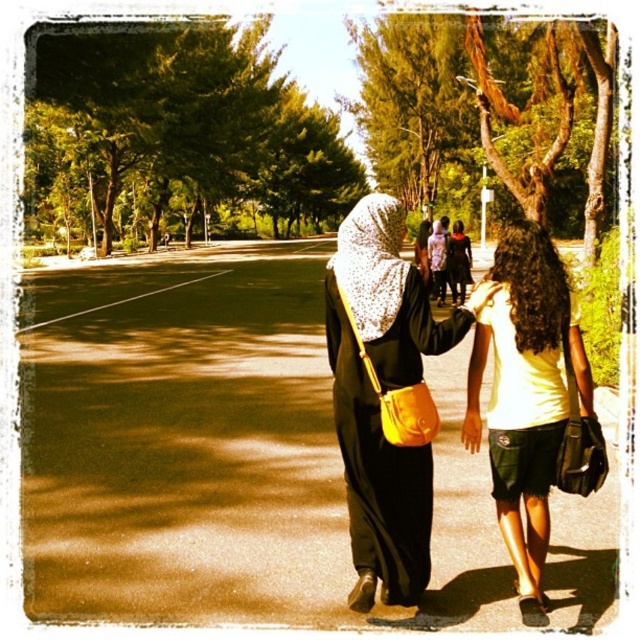
Does point (529, 460) come in front of point (532, 416)?

No, it is not.

This screenshot has width=640, height=640. I want to click on matte yellow shirt at center, so click(525, 396).

Is matte yellow bag at center taller than matte yellow shirt at center?

No, matte yellow bag at center is not taller than matte yellow shirt at center.

What do you see at coordinates (385, 397) in the screenshot? I see `matte yellow bag at center` at bounding box center [385, 397].

Does point (410, 397) come in front of point (509, 352)?

Yes, point (410, 397) is in front of point (509, 352).

I want to click on matte yellow bag at center, so click(x=385, y=397).

Does matte yellow bag at center have a greater width compared to white matte dress at center?

Yes, matte yellow bag at center is wider than white matte dress at center.

Locate an element on the screen. The height and width of the screenshot is (640, 640). matte yellow bag at center is located at coordinates (385, 397).

I want to click on matte yellow bag at center, so click(385, 397).